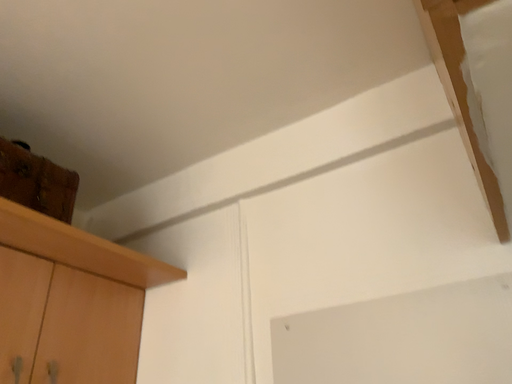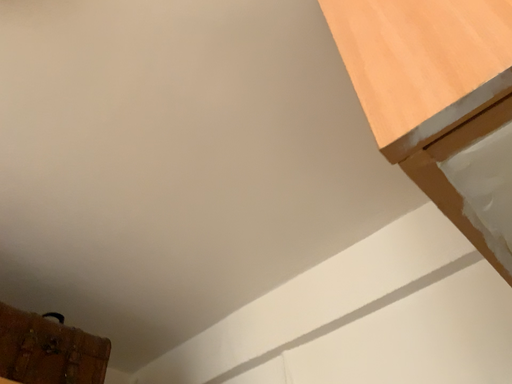
Question: How did the camera likely rotate when shooting the video?

Choices:
 (A) rotated downward
 (B) rotated upward

Answer: (B)